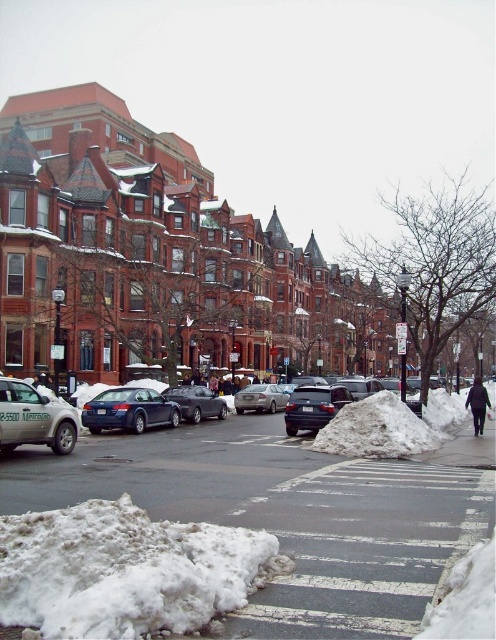
Who is more forward, (133, 602) or (11, 403)?

Positioned in front is point (133, 602).

Describe the element at coordinates (123, 570) in the screenshot. I see `white fluffy snow at lower left` at that location.

The image size is (496, 640). I want to click on white fluffy snow at lower left, so click(123, 570).

Is point (108, 388) farther from camera compared to point (197, 406)?

Yes, it is behind point (197, 406).

This screenshot has width=496, height=640. What are the coordinates of `shiny blue sedan at center` in the screenshot? It's located at (128, 410).

Find the location of a particular element. The height and width of the screenshot is (640, 496). shiny blue sedan at center is located at coordinates click(128, 410).

Where is `shiny blue sedan at center`? This screenshot has width=496, height=640. shiny blue sedan at center is located at coordinates (128, 410).

Can you confirm if white fluffy snow at lower left is thinner than shiny blue sedan at center?

In fact, white fluffy snow at lower left might be wider than shiny blue sedan at center.

Does white fluffy snow at lower left have a greater width compared to shiny blue sedan at center?

Indeed, white fluffy snow at lower left has a greater width compared to shiny blue sedan at center.

The image size is (496, 640). I want to click on white fluffy snow at lower left, so click(123, 570).